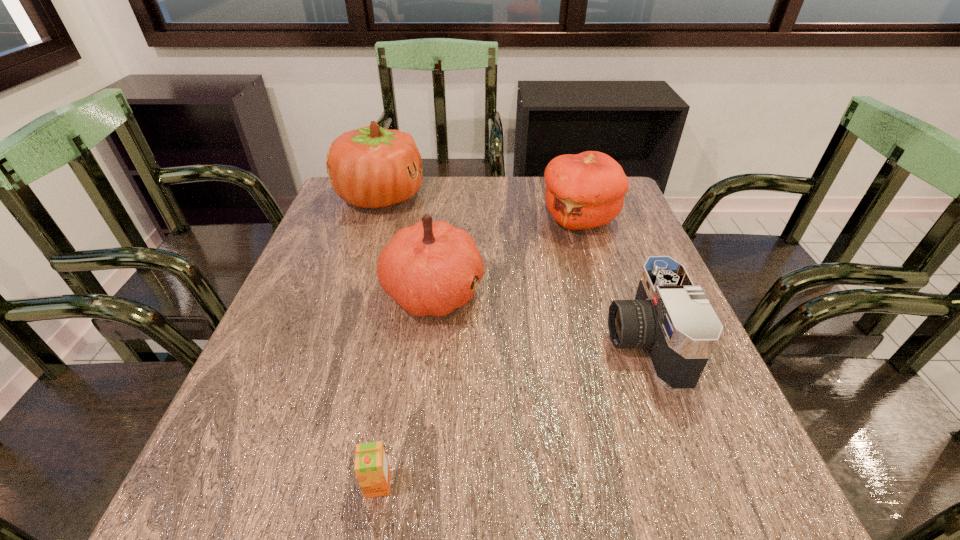
In the image, there is a desktop. Where is `vacant region at the right edge`? Image resolution: width=960 pixels, height=540 pixels. vacant region at the right edge is located at coordinates (636, 386).

You are a GUI agent. You are given a task and a screenshot of the screen. Output one action in this format:
    pyautogui.click(x=<x>, y=<y>)
    Task: Click on the free space between the nearest pumpkin and the nearest object
    This screenshot has width=960, height=540.
    Given the screenshot: What is the action you would take?
    pyautogui.click(x=406, y=388)

Locate an element on the screen. The height and width of the screenshot is (540, 960). empty space that is in between the nearest object and the nearest pumpkin is located at coordinates (406, 388).

The height and width of the screenshot is (540, 960). Find the location of `free space between the rightmost pumpkin and the nearest pumpkin`. free space between the rightmost pumpkin and the nearest pumpkin is located at coordinates (507, 255).

Locate an element on the screen. The width and height of the screenshot is (960, 540). vacant region between the orange juice and the rightmost pumpkin is located at coordinates (478, 352).

This screenshot has width=960, height=540. I want to click on vacant area between the nearest object and the rightmost pumpkin, so click(x=478, y=352).

Identify the location of the third closest object to the camera. (371, 466).

Find the location of `object that ranks as the fourth closest to the nearest pumpkin`. object that ranks as the fourth closest to the nearest pumpkin is located at coordinates point(371,466).

I want to click on the second closest pumpkin relative to the nearest pumpkin, so click(x=586, y=190).

Point out which pumpkin is positioned as the third nearest to the second shortest object. Please provide its 2D coordinates. Your answer should be formatted as a tuple, i.e. [(x, y)], where the tuple contains the x and y coordinates of a point satisfying the conditions above.

[(370, 167)]